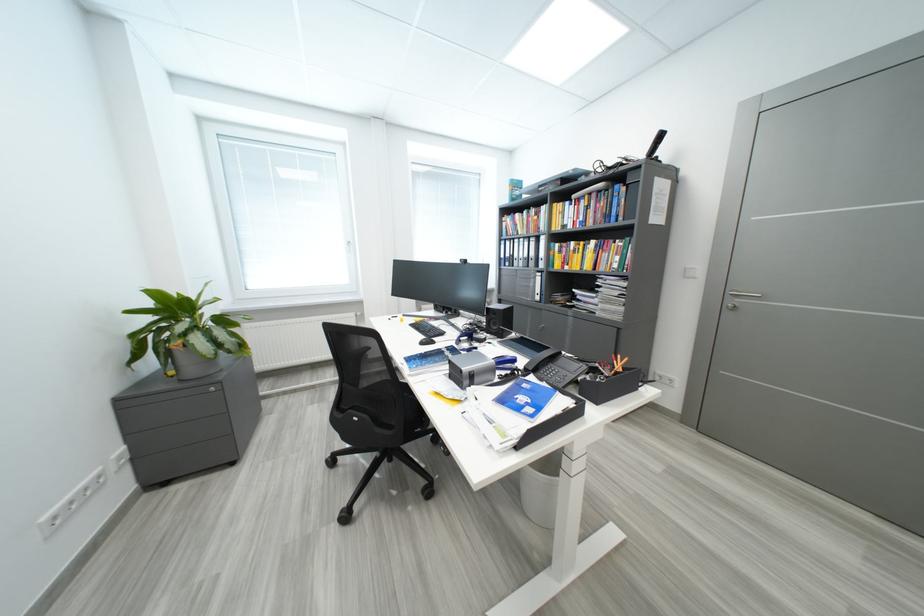
Where would you pull the gray drawer handle? Please return your answer as a coordinate pair (x, y).

(551, 336)